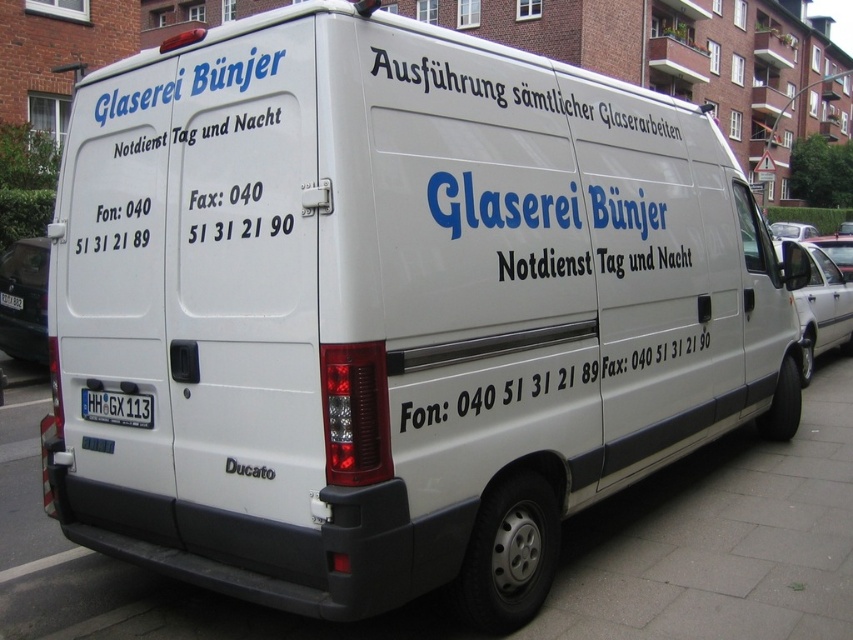
You are a delivery driver who needs to park your vehicle on the gray concrete pavement at lower center. The license plate at the rear of your van must fit entirely on the pavement. Given that your van has a white plastic license plate at rear, will the pavement be wide enough to accommodate the license plate?

The gray concrete pavement at lower center has a width less than the white plastic license plate at rear, so it is not wide enough to accommodate the license plate entirely.

You are a delivery driver who needs to read the phone number on the van. The van has a white vinyl text at center and a white plastic license plate at rear. Which object should you look at to find the phone number?

The white vinyl text at center contains the phone number, so you should look at the white vinyl text at center.